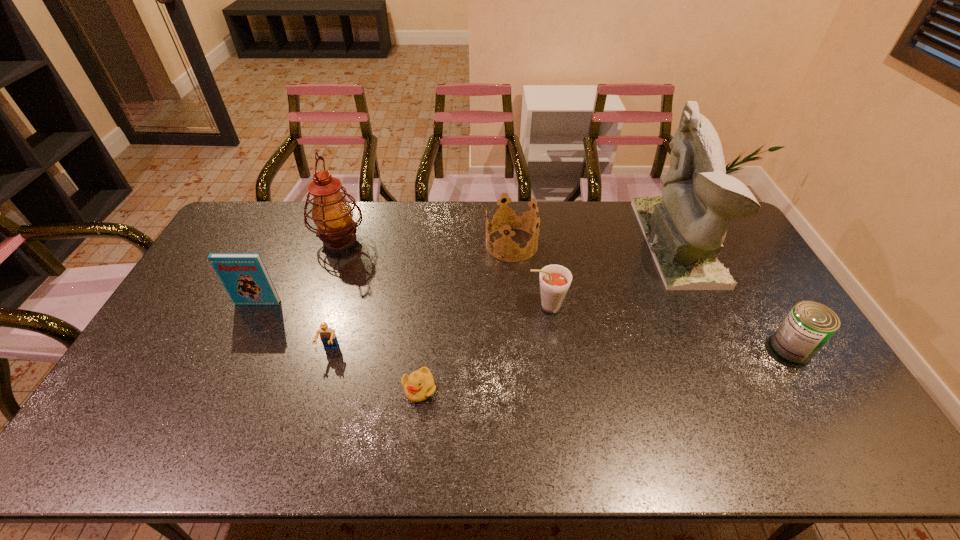
What are the coordinates of `free location located on the base of the tallest object` in the screenshot? It's located at (572, 242).

I want to click on blank space located 0.390m on the base of the tallest object, so click(539, 242).

At what (x,y) coordinates should I click in order to perform the action: click on free space located on the base of the tallest object. Please return your answer as a coordinate pair (x, y). This screenshot has width=960, height=540. Looking at the image, I should click on (575, 242).

The image size is (960, 540). I want to click on free space located on the back of the oil lamp, so click(x=351, y=207).

Where is `vacant space located 0.280m on the front cover of the book`? vacant space located 0.280m on the front cover of the book is located at coordinates (219, 384).

Locate an element on the screen. The width and height of the screenshot is (960, 540). vacant region located on the drink side of the root beer is located at coordinates (445, 306).

You are a GUI agent. You are given a task and a screenshot of the screen. Output one action in this format:
    pyautogui.click(x=<x>, y=<y>)
    Task: Click on the free spot located on the drink side of the root beer
    Image resolution: width=960 pixels, height=540 pixels.
    Given the screenshot: What is the action you would take?
    pyautogui.click(x=462, y=306)

Locate an element on the screen. This screenshot has height=540, width=960. free spot located on the drink side of the root beer is located at coordinates (452, 306).

The height and width of the screenshot is (540, 960). What are the coordinates of `vacant space located 0.290m on the right of the crown` in the screenshot? It's located at (619, 245).

Locate an element on the screen. This screenshot has width=960, height=540. free space located 0.360m on the left of the rightmost object is located at coordinates (645, 348).